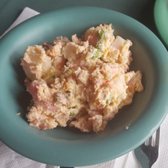
Find the location of a particular element. This screenshot has width=168, height=168. napkin is located at coordinates (27, 11).